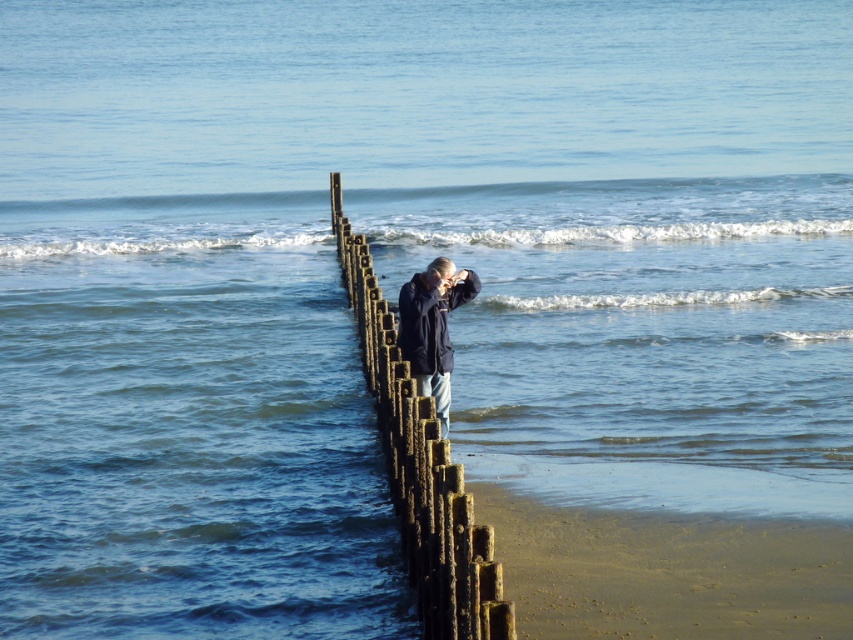
Is point (389, 406) positioned after point (401, 333)?

No.

Between wooden post at center and dark blue jacket at center, which one appears on the right side from the viewer's perspective?

Positioned to the right is dark blue jacket at center.

Which is in front, point (404, 419) or point (440, 406)?

Point (404, 419)

In order to click on wooden post at center in this screenshot , I will do `click(421, 468)`.